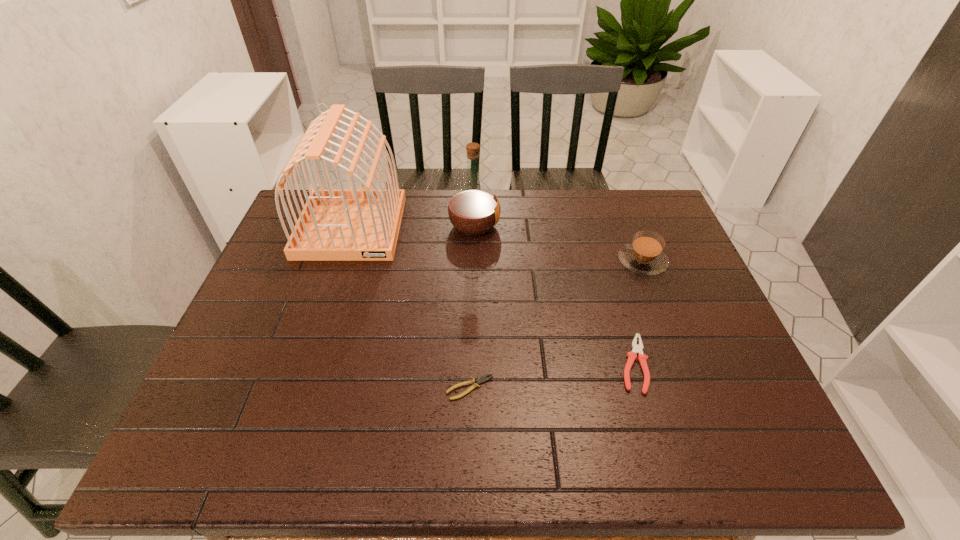
Locate an element on the screen. Image resolution: width=960 pixels, height=540 pixels. birdcage is located at coordinates (352, 224).

This screenshot has width=960, height=540. Identify the location of the tallest object. (352, 224).

Find the location of a particular element. liquor is located at coordinates (473, 210).

The width and height of the screenshot is (960, 540). Identify the location of the rightmost object. (644, 255).

The height and width of the screenshot is (540, 960). I want to click on the third shortest object, so click(644, 255).

Locate an element on the screen. The width and height of the screenshot is (960, 540). the taller pliers is located at coordinates (637, 349).

Locate an element on the screen. the second shortest object is located at coordinates (637, 349).

Identify the location of the shortest object. (476, 382).

Identify the location of the shorter pliers. Image resolution: width=960 pixels, height=540 pixels. (476, 382).

This screenshot has height=540, width=960. I want to click on vacant region located with an open door on the tallest object, so click(331, 288).